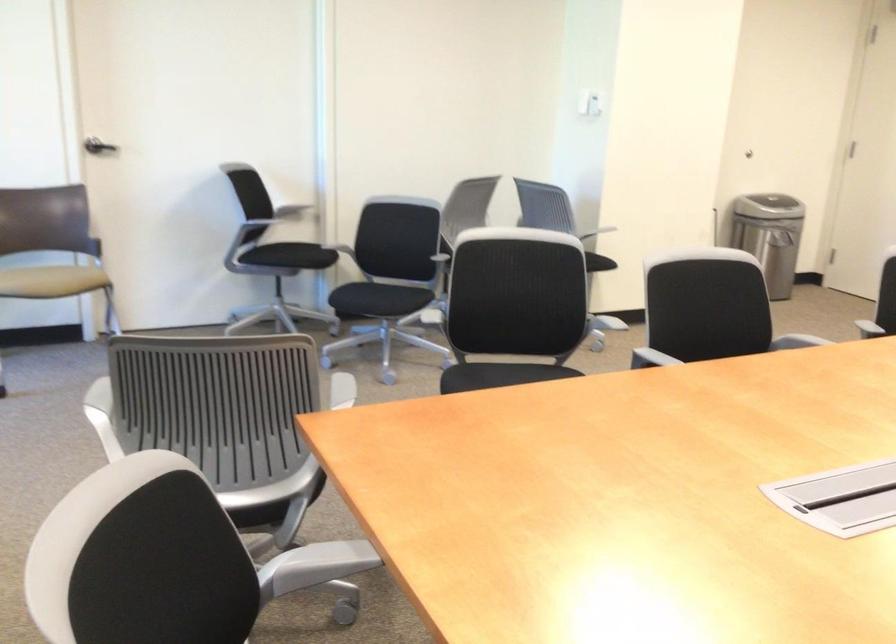
Describe the element at coordinates (765, 212) in the screenshot. I see `the trash can lid` at that location.